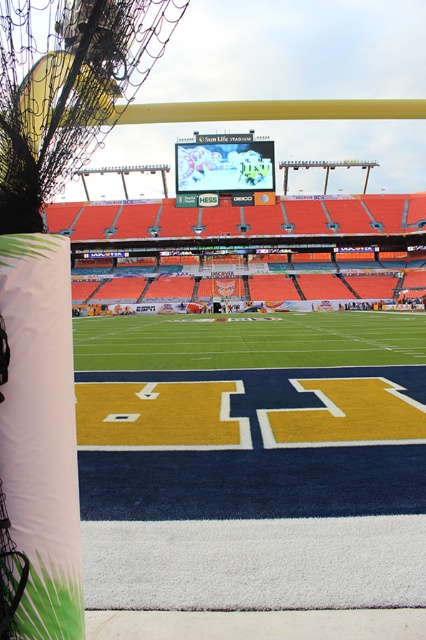
You are standing at the entrance of the stadium and want to locate the green turf football field at center. According to the coordinates provided, where should you look?

The green turf football field at center is located at coordinates point (247, 340).

You are a photographer positioned at the edge of the field. You want to capture a shot that includes both the yellow turf at center and the white fabric banner at left. Based on their positions, which object should you adjust your camera to focus on first to ensure both are in frame?

The white fabric banner at left should be focused on first since the yellow turf at center is to the right of it, so adjusting from the leftward object ensures both are included in the frame.

You are a photographer standing at the edge of the field. You want to capture a wide shot that includes both the yellow turf at center and the white fabric banner at left. Based on their sizes, which object should you focus on to ensure both are clearly visible in the frame?

The yellow turf at center is wider than the white fabric banner at left, so focusing on the yellow turf at center will help ensure both objects are clearly visible in the frame.